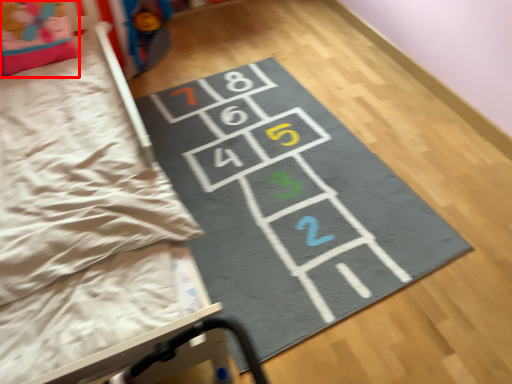
Question: Where is pillow (annotated by the red box) located in relation to yoga mat in the image?

Choices:
 (A) left
 (B) right

Answer: (A)